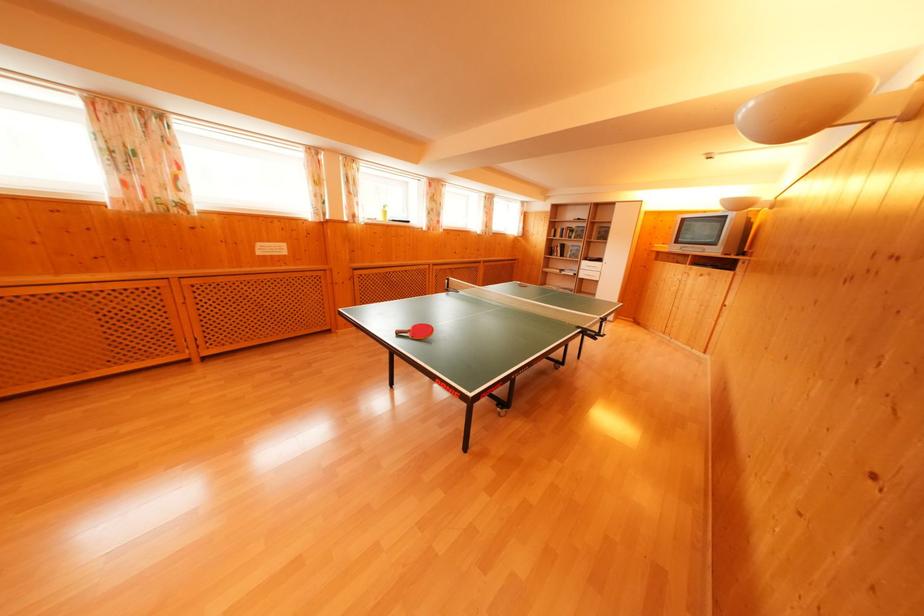
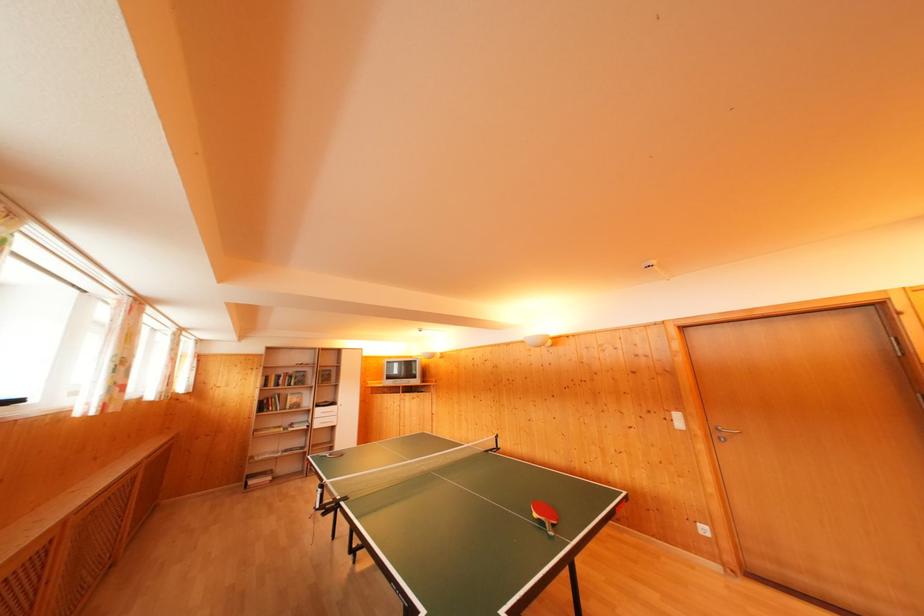
Find the pixel in the second image that matches (x=590, y=268) in the first image.

(322, 416)